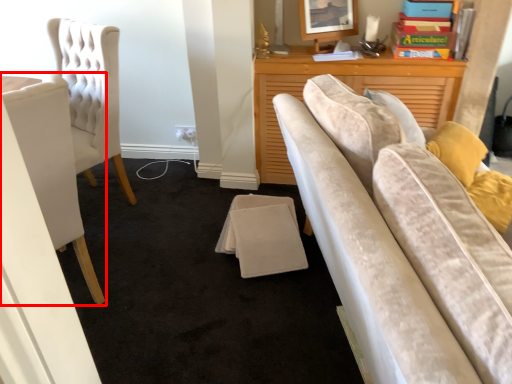
Question: From the image's perspective, what is the correct spatial positioning of chair (annotated by the red box) in reference to picture frame?

Choices:
 (A) below
 (B) above

Answer: (A)